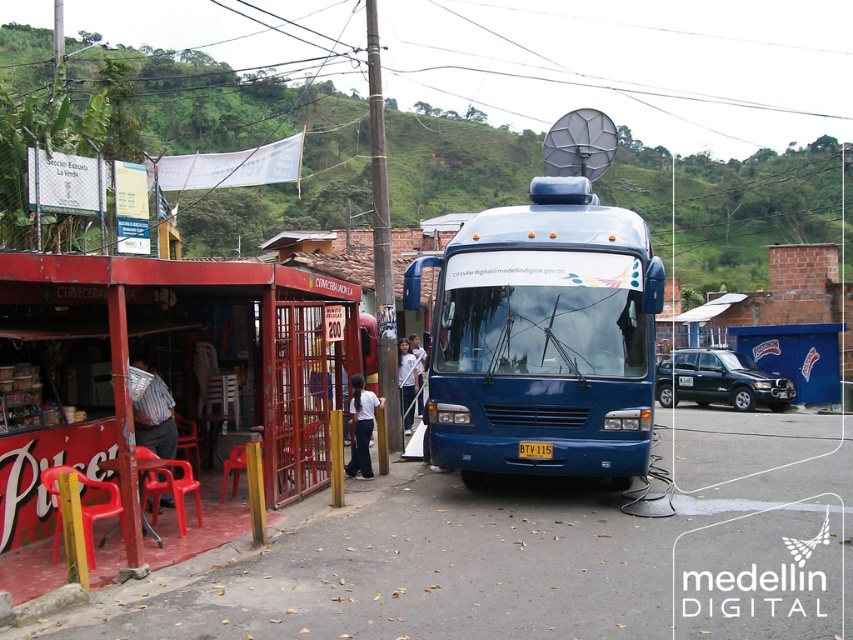
You are standing at the point with coordinates 0.5, 0.6. You want to walk to the blue metallic bus at center. In which direction should you walk?

Since the blue metallic bus at center is located at point (543, 339), you should walk northeast to reach it from your current position at (511, 320).

You are a delivery person trying to reach the Cerveceria shop. You see the plastic chairs at lower left and the white matte shirt at center. Which object is closer to the ground?

The plastic chairs at lower left are closer to the ground since they are not as tall as the white matte shirt at center.